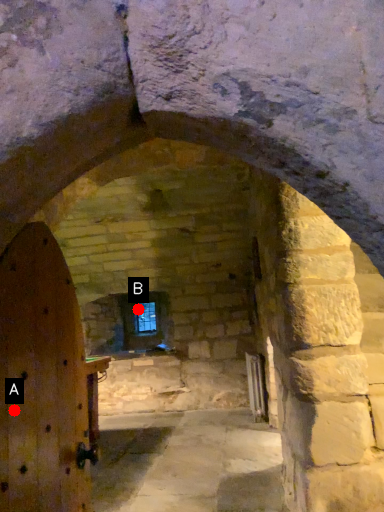
Question: Two points are circled on the image, labeled by A and B beside each circle. Which point is further to the camera?

Choices:
 (A) A is further
 (B) B is further

Answer: (B)